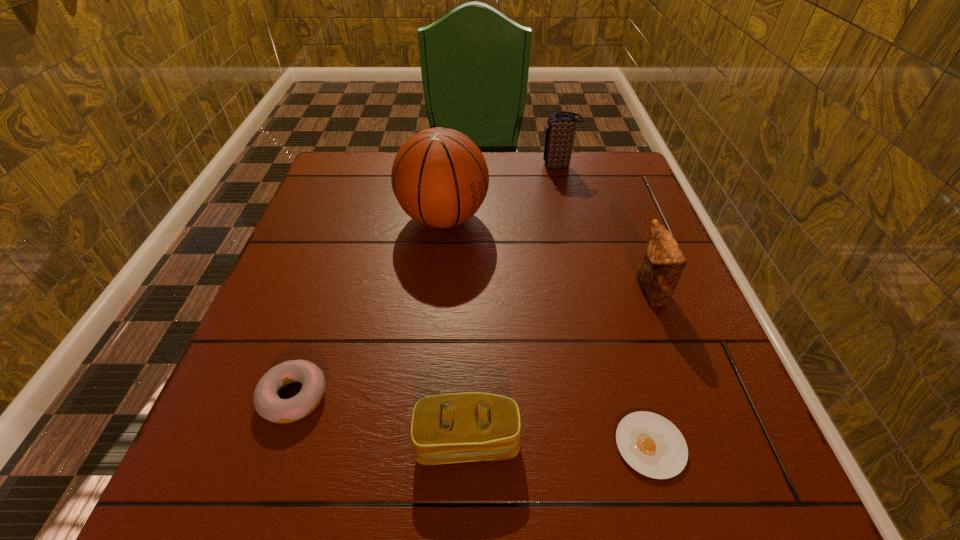
At what (x,y) coordinates should I click in order to perform the action: click on basketball at the far edge. Please return your answer as a coordinate pair (x, y). The width and height of the screenshot is (960, 540). Looking at the image, I should click on (440, 178).

This screenshot has width=960, height=540. I want to click on clutch bag that is positioned at the far edge, so click(560, 128).

At what (x,y) coordinates should I click in order to perform the action: click on clutch bag that is at the near edge. Please return your answer as a coordinate pair (x, y). The width and height of the screenshot is (960, 540). Looking at the image, I should click on pos(459,427).

Where is `egg yolk that is at the near edge`? This screenshot has width=960, height=540. egg yolk that is at the near edge is located at coordinates (652, 445).

Where is `object that is at the left edge`? The width and height of the screenshot is (960, 540). object that is at the left edge is located at coordinates (267, 403).

This screenshot has height=540, width=960. Find the location of `egg yolk that is at the right edge`. egg yolk that is at the right edge is located at coordinates (652, 445).

Find the location of a particular element. object at the far right corner is located at coordinates (560, 128).

Find the location of a particular element. The image size is (960, 540). object positioned at the near right corner is located at coordinates (652, 445).

Identify the location of vacant region at the far edge of the desktop. This screenshot has height=540, width=960. (496, 175).

In the image, there is a desktop. Identify the location of vacant space at the near edge. This screenshot has width=960, height=540. (524, 488).